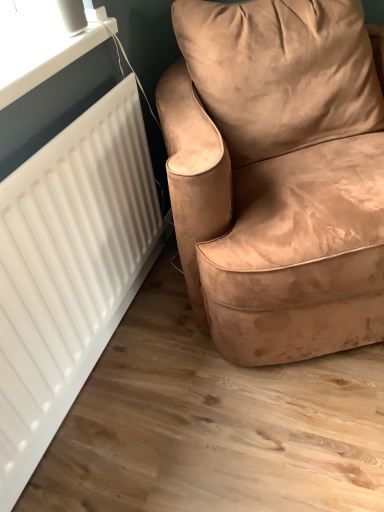
Describe the element at coordinates (277, 175) in the screenshot. The width and height of the screenshot is (384, 512). I see `suede-like tan chair at right` at that location.

What are the coordinates of `suede-like tan chair at right` in the screenshot? It's located at (277, 175).

Where is `suede-like tan chair at right`? This screenshot has width=384, height=512. suede-like tan chair at right is located at coordinates coord(277,175).